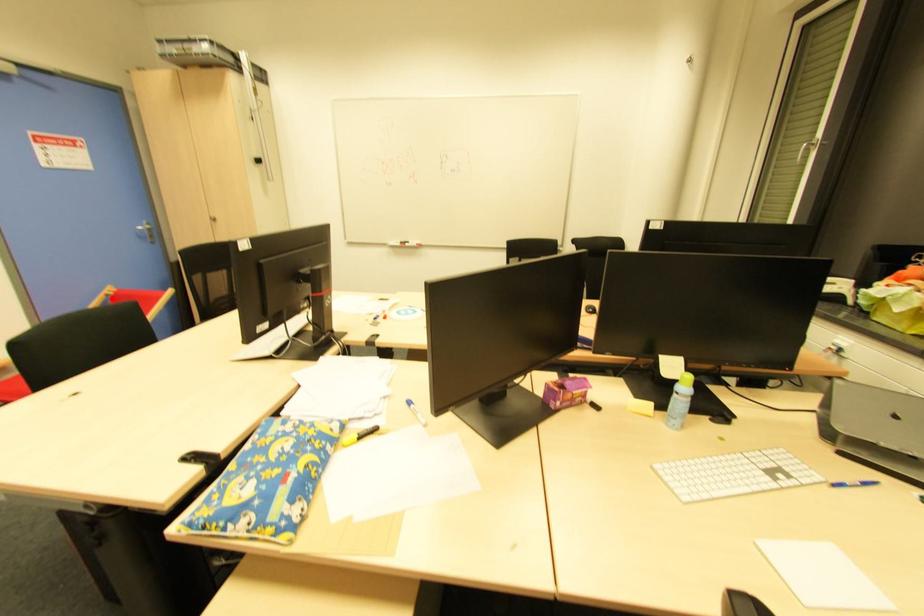
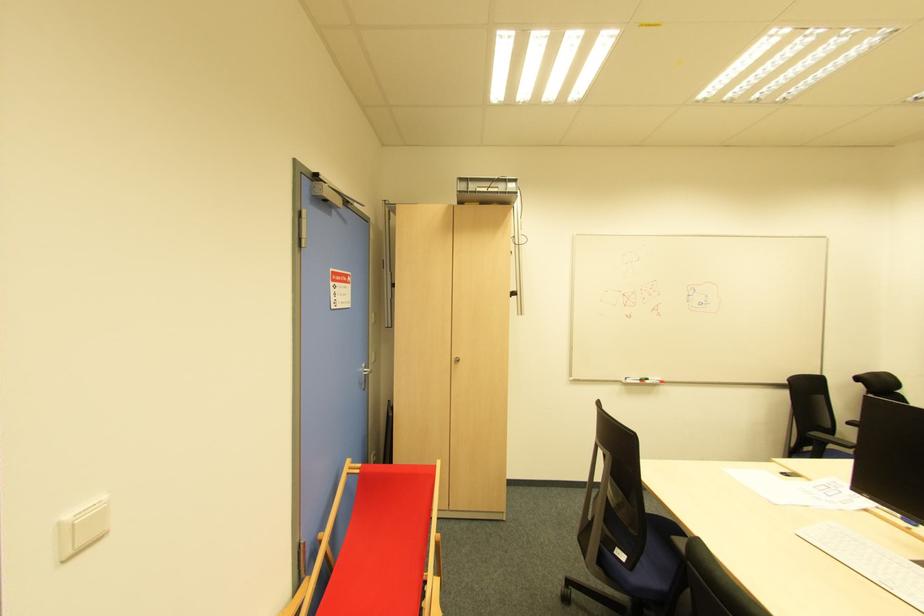
Locate, in the second image, the point that corresponds to the highlighted location in the first image.

(357, 477)